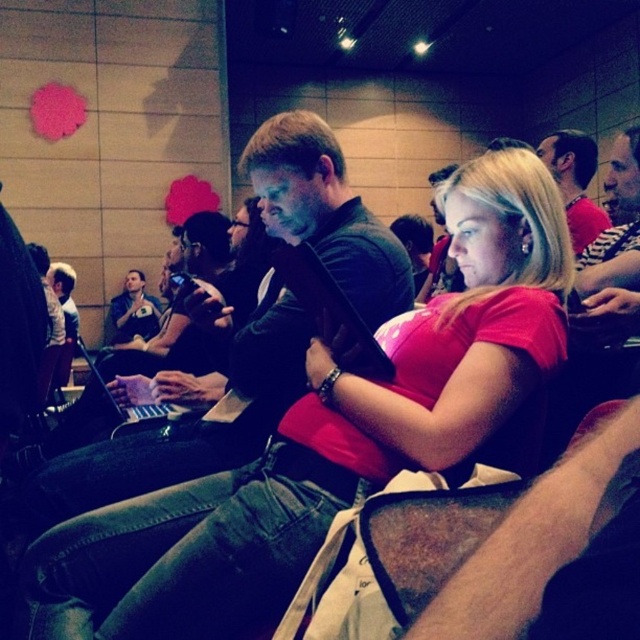
Question: Which object is positioned closest to the matte pink shirt at center?

Choices:
 (A) matte black shirt at center
 (B) striped shirt at upper right
 (C) matte black laptop at left

Answer: (B)

Question: Is matte pink shirt at center to the right of striped shirt at upper right from the viewer's perspective?

Choices:
 (A) yes
 (B) no

Answer: (B)

Question: Is matte pink shirt at center to the left of striped shirt at upper right from the viewer's perspective?

Choices:
 (A) yes
 (B) no

Answer: (A)

Question: Considering the real-world distances, which object is closest to the striped shirt at upper right?

Choices:
 (A) matte pink shirt at center
 (B) matte black shirt at center

Answer: (B)

Question: Is matte pink shirt at center below matte black laptop at left?

Choices:
 (A) no
 (B) yes

Answer: (B)

Question: Which object is the closest to the matte black shirt at center?

Choices:
 (A) striped shirt at upper right
 (B) matte black laptop at left
 (C) matte pink shirt at center

Answer: (A)